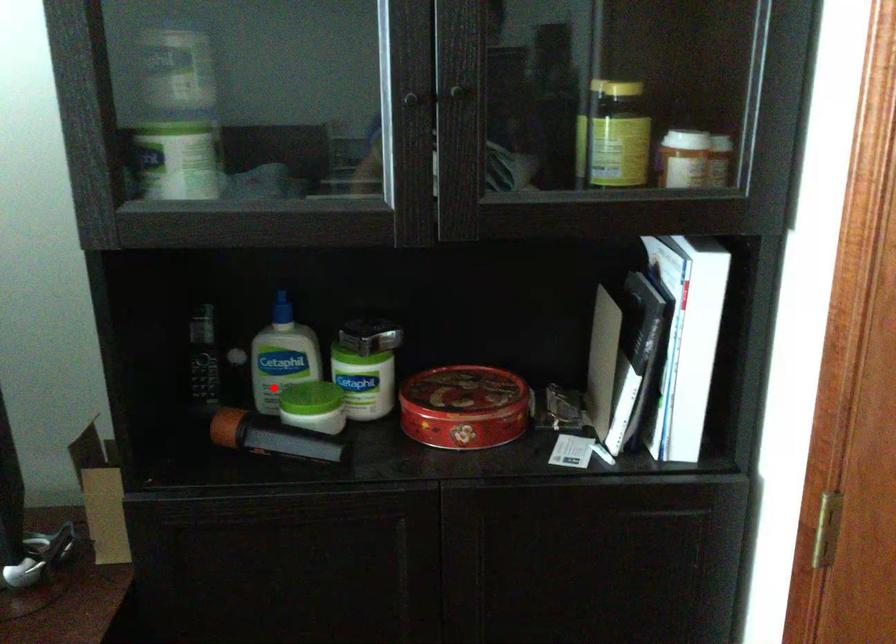
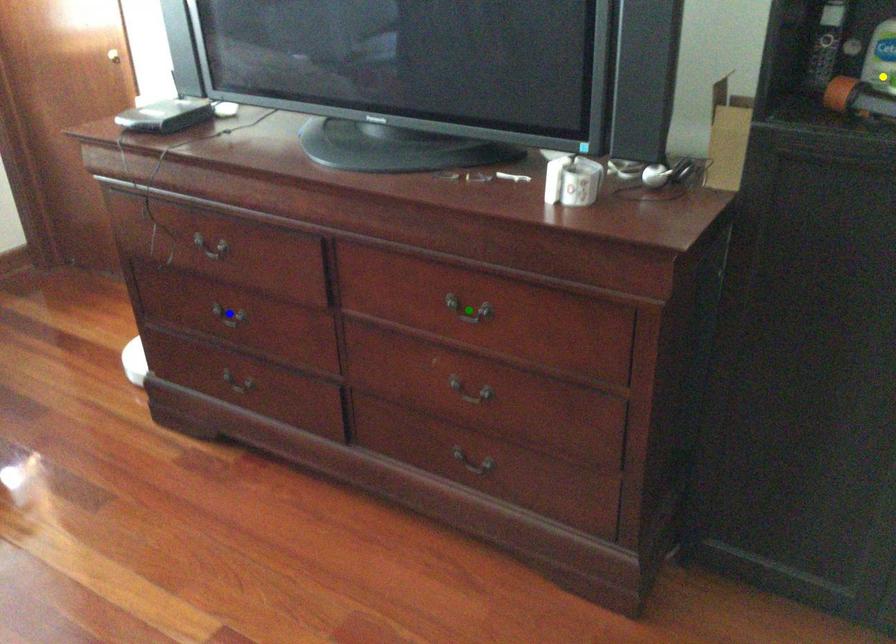
Question: I am providing you with two images of the same scene from different viewpoints. A red point is marked on the first image. You are given multiple points on the second image. Which point in image 2 is actually the same real-world point as the red point in image 1?

Choices:
 (A) yellow point
 (B) green point
 (C) blue point

Answer: (A)